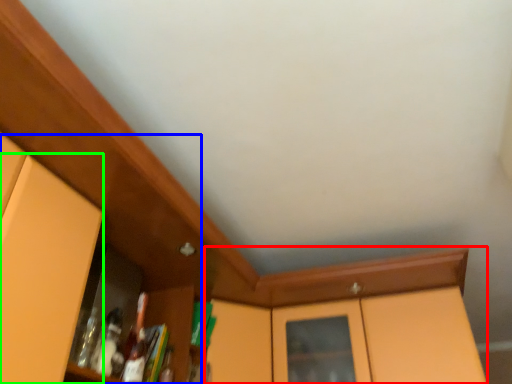
Question: Which is nearer to the cabinetry (highlighted by a red box)? dresser (highlighted by a blue box) or door (highlighted by a green box).

Choices:
 (A) dresser
 (B) door

Answer: (B)